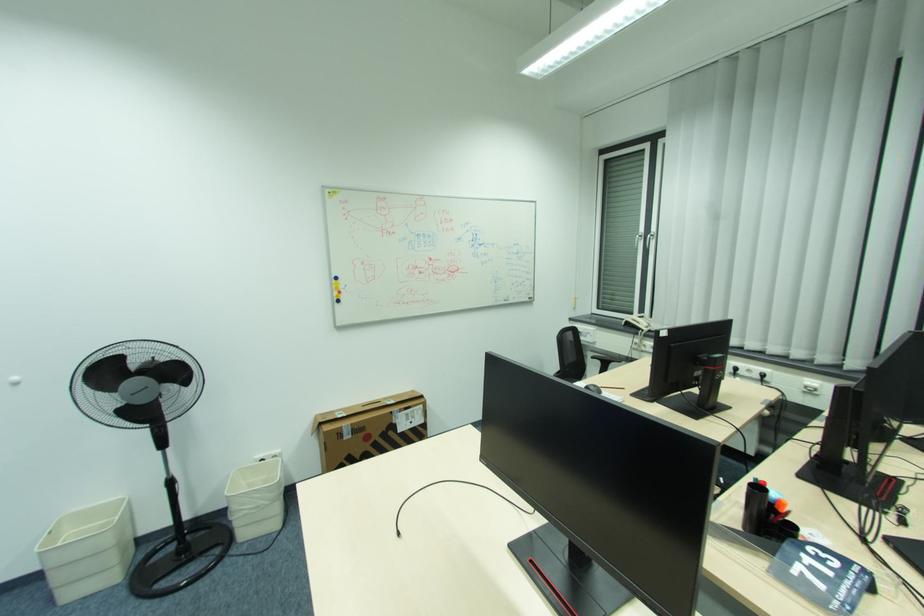
Find where to resting arm the chair armrest. Please return your answer as a coordinate pair (x, y).

(604, 359)